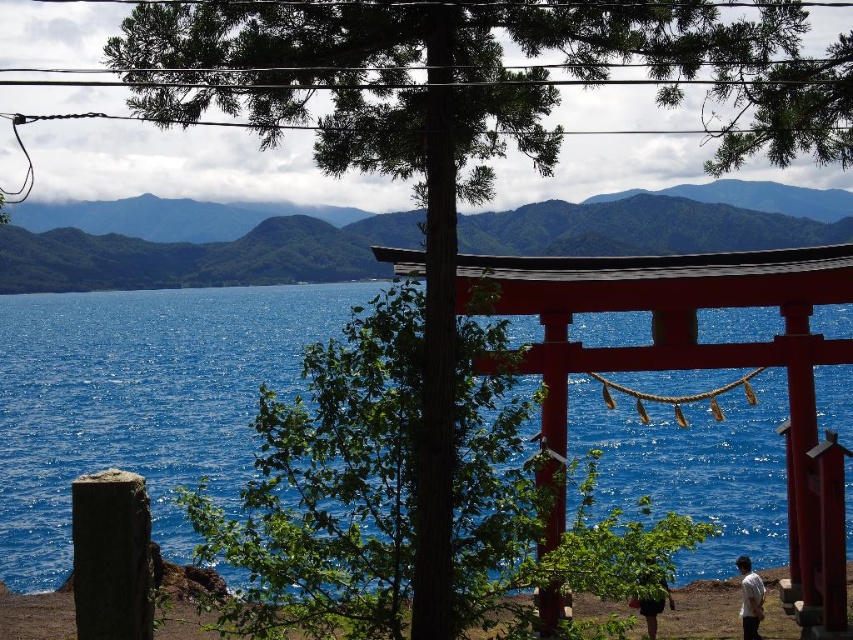
Looking at this image, which is below, white cotton shirt at lower right or green leafy hair at lower center?

white cotton shirt at lower right is lower down.

At what (x,y) coordinates should I click in order to perform the action: click on white cotton shirt at lower right. Please return your answer as a coordinate pair (x, y). This screenshot has height=640, width=853. Looking at the image, I should click on (750, 598).

Does blue liquid water at center lie in front of green leafy hair at lower center?

Yes, it is in front of green leafy hair at lower center.

Who is positioned more to the left, blue liquid water at center or green leafy hair at lower center?

From the viewer's perspective, green leafy hair at lower center appears more on the left side.

Describe the element at coordinates (140, 401) in the screenshot. I see `blue liquid water at center` at that location.

Find the location of a particular element. The width and height of the screenshot is (853, 640). blue liquid water at center is located at coordinates (140, 401).

In the scene shown: Can you confirm if blue liquid water at center is positioned below white cotton shirt at lower right?

No, blue liquid water at center is not below white cotton shirt at lower right.

Who is more forward, (210, 368) or (751, 604)?

Point (751, 604)

The image size is (853, 640). Describe the element at coordinates (140, 401) in the screenshot. I see `blue liquid water at center` at that location.

This screenshot has width=853, height=640. Identify the location of blue liquid water at center. point(140,401).